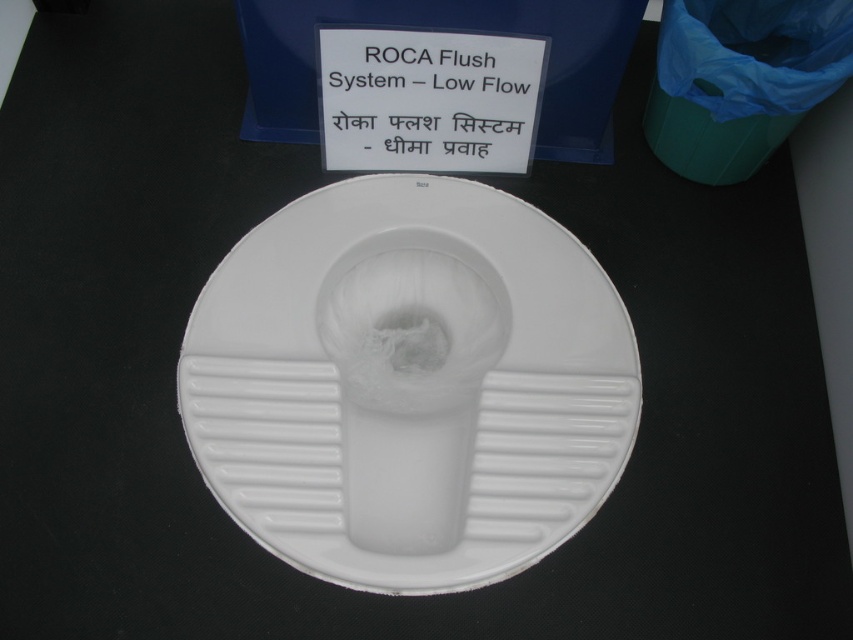
You are setting up an exhibit and need to place a 10cm tall decorative item on either the white matte toilet at center or the white plastic sign at upper center. Which object can accommodate the item without it toppling over?

The white matte toilet at center is taller than the white plastic sign at upper center, so placing the 10cm tall decorative item on the white matte toilet at center would be more stable and less likely to topple over.

You are designing a display for a bathroom exhibit. You have a white matte toilet at center and a white plastic sign at upper center. The display area has limited space. Which object should you prioritize placing first to accommodate their sizes?

The white matte toilet at center should be prioritized because it is wider than the white plastic sign at upper center, requiring more space.